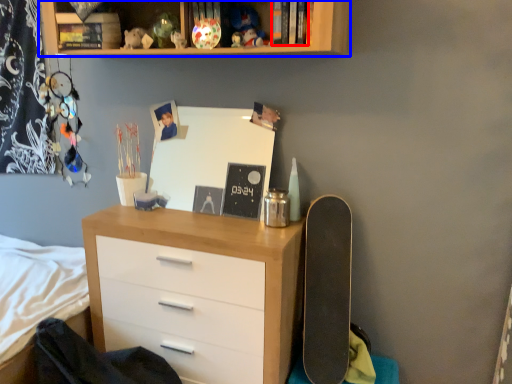
Question: Among these objects, which one is farthest to the camera, book (highlighted by a red box) or shelf (highlighted by a blue box)?

Choices:
 (A) book
 (B) shelf

Answer: (A)